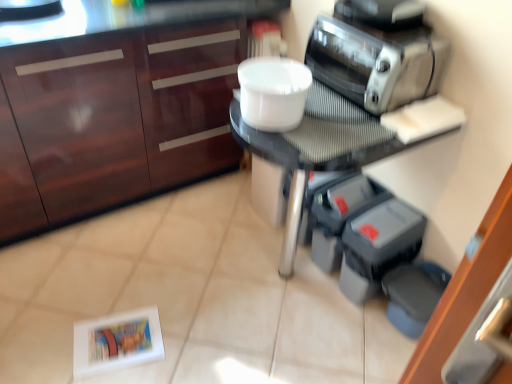
This screenshot has height=384, width=512. Identify the location of free location in front of matte black table at center. (294, 349).